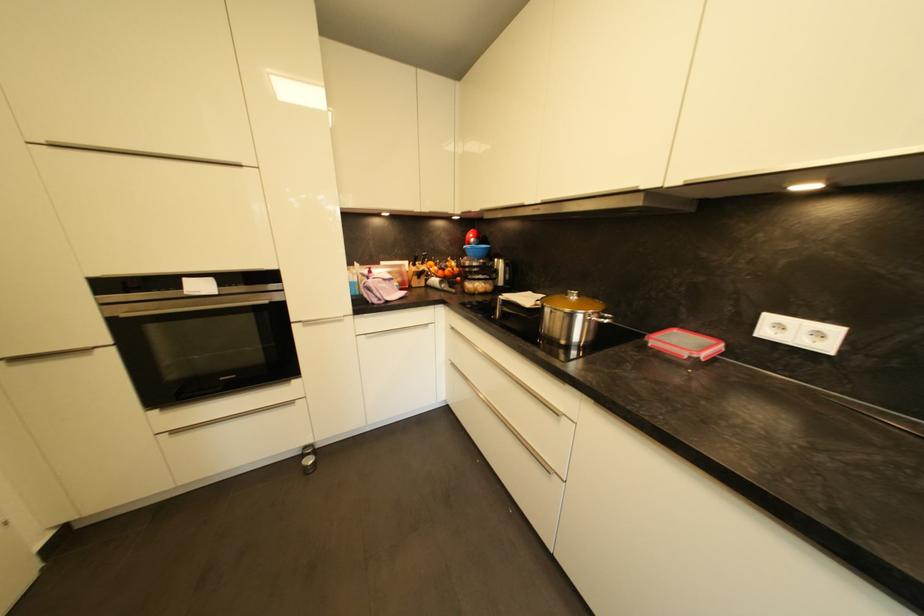
Locate an element on the screen. The width and height of the screenshot is (924, 616). oven door handle is located at coordinates [187, 302].